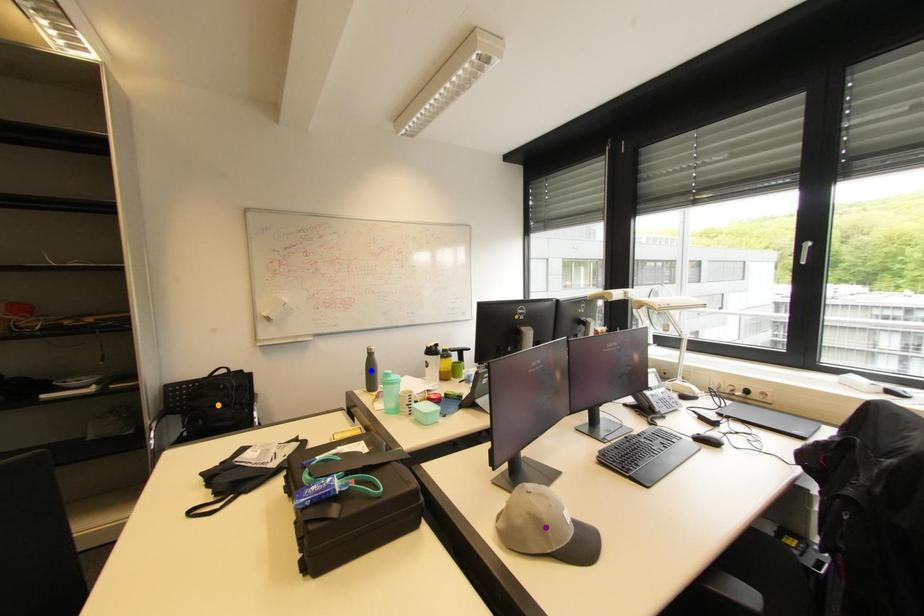
Order these from nearest to farthest:
orange point | blue point | purple point

purple point < blue point < orange point